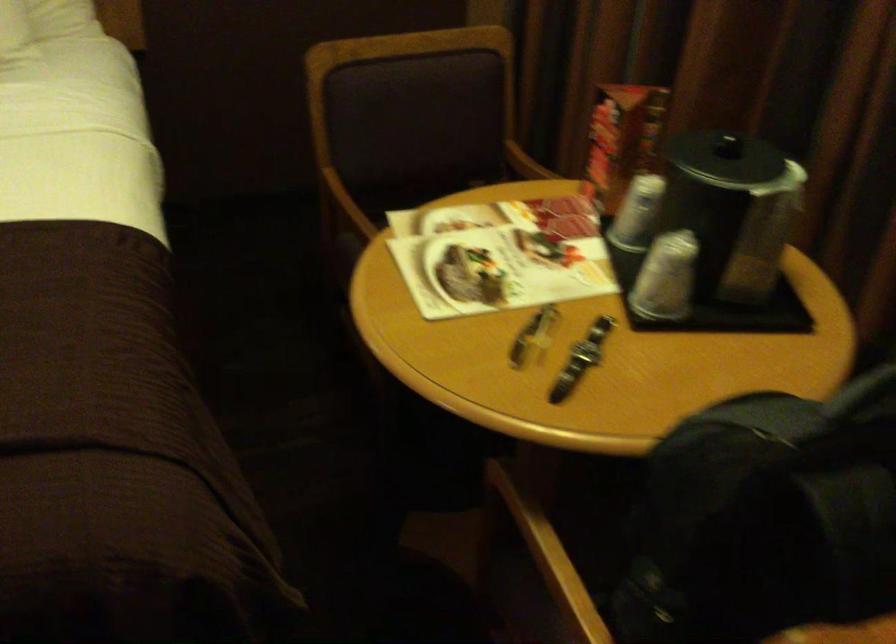
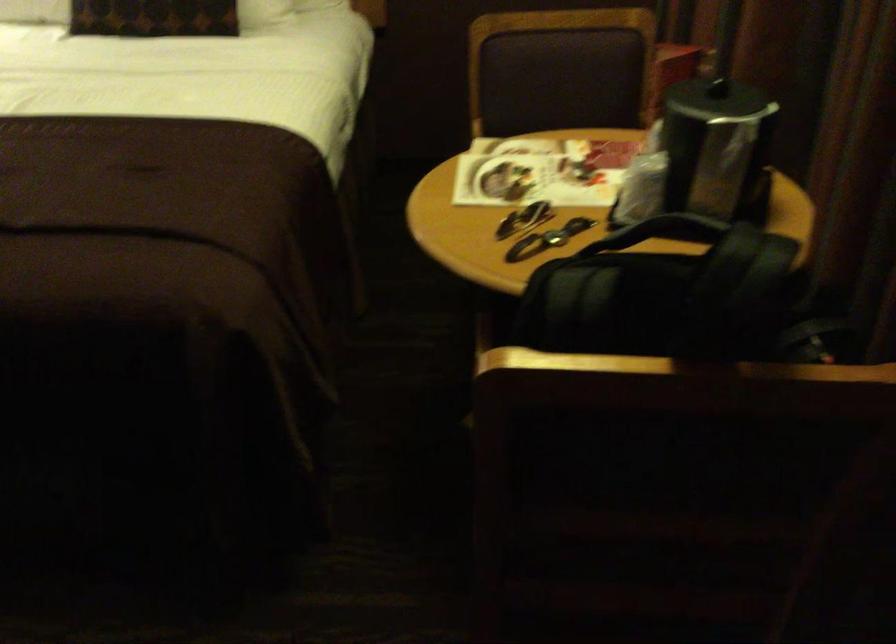
Locate, in the second image, the point that corresponds to point 420,152 in the first image.

(553, 113)